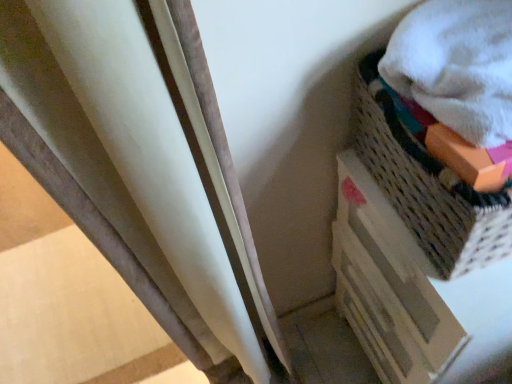
Identify the location of woven fabric basket at upper right. (429, 181).

The height and width of the screenshot is (384, 512). What do you see at coordinates (429, 181) in the screenshot?
I see `woven fabric basket at upper right` at bounding box center [429, 181].

Find the location of `woven fabric basket at upper right`. woven fabric basket at upper right is located at coordinates (429, 181).